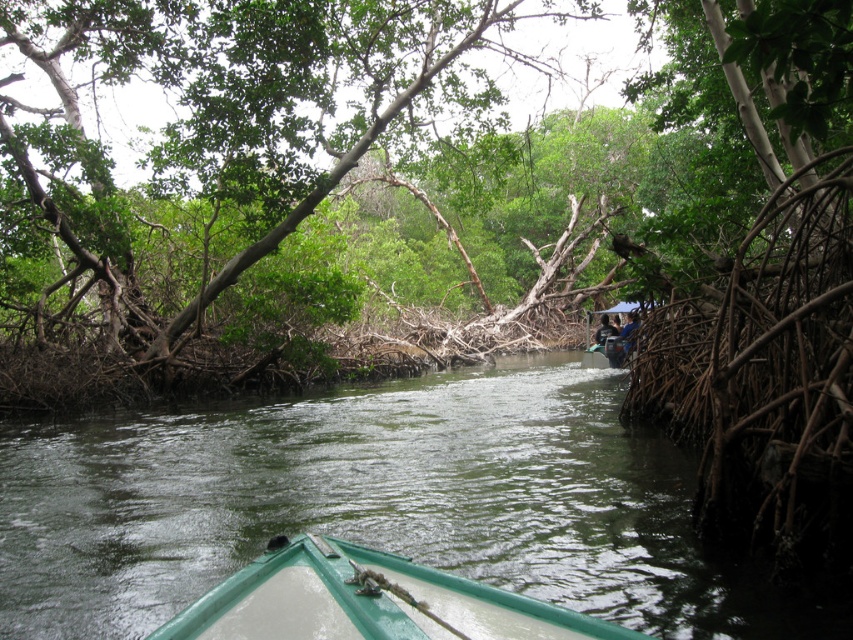
Question: Is green rubber boat at center wider than dark blue fabric at center?

Choices:
 (A) yes
 (B) no

Answer: (A)

Question: Which of the following is the closest to the observer?

Choices:
 (A) (311, 49)
 (B) (167, 566)
 (C) (602, 368)
 (D) (376, 589)

Answer: (D)

Question: Where is green rubber boat at center located in relation to green matte boat at center in the image?

Choices:
 (A) left
 (B) right

Answer: (A)

Question: Which of the following is the farthest from the observer?

Choices:
 (A) dark blue fabric at center
 (B) green rubber boat at center

Answer: (A)

Question: Considering the real-world distances, which object is closest to the green matte canoe at center?

Choices:
 (A) green matte boat at center
 (B) green leafy tree at center

Answer: (A)

Question: Considering the relative positions of green leafy tree at center and green matte canoe at center in the image provided, where is green leafy tree at center located with respect to green matte canoe at center?

Choices:
 (A) above
 (B) below

Answer: (A)